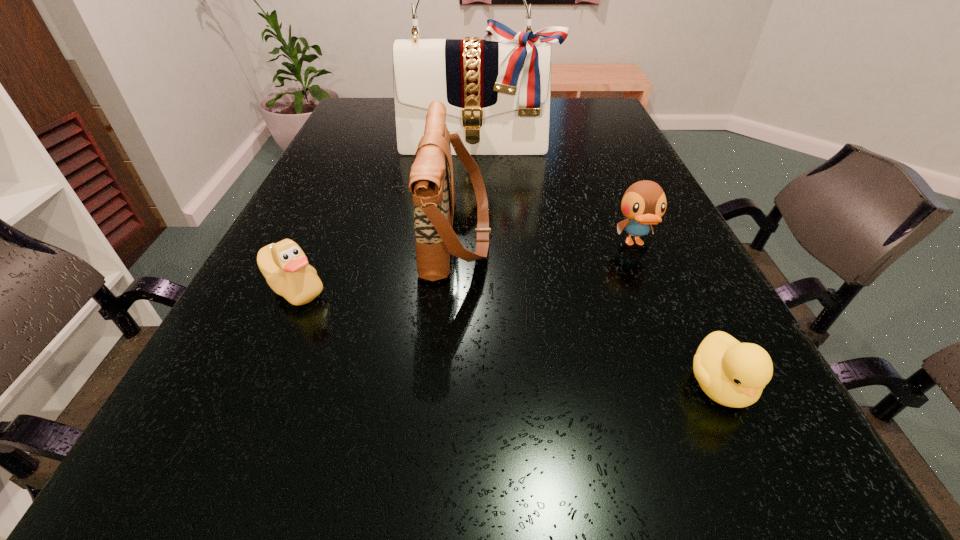
You are a GUI agent. You are given a task and a screenshot of the screen. Output one action in this format:
    pyautogui.click(x=<x>, y=<y>)
    Task: Click on the vacant region between the second nearest duck and the farthest duck
    
    Given the screenshot: What is the action you would take?
    pyautogui.click(x=465, y=266)

The height and width of the screenshot is (540, 960). In order to click on vacant area between the farthest duck and the nearest duck in this screenshot , I will do `click(677, 314)`.

Find the location of `free space between the farthest object and the nearest object`. free space between the farthest object and the nearest object is located at coordinates (599, 266).

This screenshot has height=540, width=960. What are the coordinates of `free spot between the shoulder bag and the leftmost duck` in the screenshot? It's located at pos(376,261).

Where is `vacant area between the nearest duck and the second tallest object`? This screenshot has height=540, width=960. vacant area between the nearest duck and the second tallest object is located at coordinates (588, 309).

Locate an element on the screen. This screenshot has width=960, height=540. vacant area between the leftmost object and the farthest object is located at coordinates (x=386, y=217).

Identify which object is the fourth closest to the nearest duck. Please provide its 2D coordinates. Your answer should be formatted as a tuple, i.e. [(x, y)], where the tuple contains the x and y coordinates of a point satisfying the conditions above.

[(497, 90)]

The width and height of the screenshot is (960, 540). I want to click on object that is the third closest to the tallest object, so click(284, 265).

Identify which duck is the second closest to the second tallest object. Please provide its 2D coordinates. Your answer should be formatted as a tuple, i.e. [(x, y)], where the tuple contains the x and y coordinates of a point satisfying the conditions above.

[(644, 203)]

Locate which duck is the closest to the nearest duck. Please provide its 2D coordinates. Your answer should be formatted as a tuple, i.e. [(x, y)], where the tuple contains the x and y coordinates of a point satisfying the conditions above.

[(644, 203)]